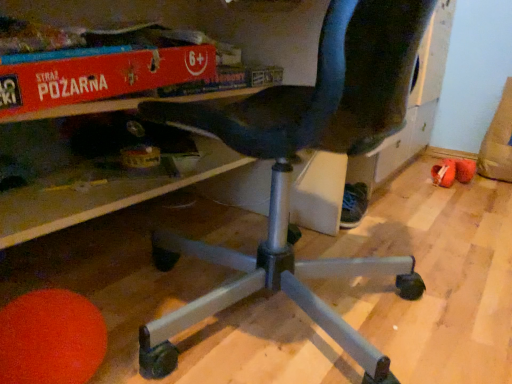
Question: Are brown suede bean bag at lower right and red cardboard box at upper center beside each other?

Choices:
 (A) yes
 (B) no

Answer: (B)

Question: Does brown suede bean bag at lower right have a larger size compared to red cardboard box at upper center?

Choices:
 (A) yes
 (B) no

Answer: (A)

Question: From the image's perspective, is brown suede bean bag at lower right on red cardboard box at upper center?

Choices:
 (A) no
 (B) yes

Answer: (B)

Question: Is brown suede bean bag at lower right behind red cardboard box at upper center?

Choices:
 (A) no
 (B) yes

Answer: (B)

Question: Is brown suede bean bag at lower right positioned in front of red cardboard box at upper center?

Choices:
 (A) no
 (B) yes

Answer: (A)

Question: Considering the positions of brown suede bean bag at lower right and black fabric shoe at lower center, the second footwear from the back, in the image, is brown suede bean bag at lower right taller or shorter than black fabric shoe at lower center, the second footwear from the back,?

Choices:
 (A) short
 (B) tall

Answer: (B)

Question: Considering the relative positions of brown suede bean bag at lower right and black fabric shoe at lower center, which ranks as the first footwear in front-to-back order, in the image provided, is brown suede bean bag at lower right to the left or to the right of black fabric shoe at lower center, which ranks as the first footwear in front-to-back order,?

Choices:
 (A) right
 (B) left

Answer: (A)

Question: In the image, is brown suede bean bag at lower right positioned in front of or behind black fabric shoe at lower center, the second footwear from the back?

Choices:
 (A) front
 (B) behind

Answer: (B)

Question: Considering the positions of point (482, 147) and point (354, 188), is point (482, 147) closer or farther from the camera than point (354, 188)?

Choices:
 (A) farther
 (B) closer

Answer: (A)

Question: From a real-world perspective, is black fabric shoe at lower center, the 1th footwear in the left-to-right sequence, physically located above or below brown suede bean bag at lower right?

Choices:
 (A) below
 (B) above

Answer: (A)

Question: From their relative heights in the image, would you say black fabric shoe at lower center, which ranks as the first footwear in front-to-back order, is taller or shorter than brown suede bean bag at lower right?

Choices:
 (A) short
 (B) tall

Answer: (A)

Question: Is point (345, 188) closer or farther from the camera than point (497, 112)?

Choices:
 (A) farther
 (B) closer

Answer: (B)

Question: Is black fabric shoe at lower center, the second footwear from the back, bigger or smaller than brown suede bean bag at lower right?

Choices:
 (A) big
 (B) small

Answer: (B)

Question: From their relative heights in the image, would you say red cardboard box at upper center is taller or shorter than orange fabric shoe at lower right, placed as the second footwear when sorted from left to right?

Choices:
 (A) short
 (B) tall

Answer: (B)

Question: Is point (93, 61) positioned closer to the camera than point (442, 178)?

Choices:
 (A) farther
 (B) closer

Answer: (B)